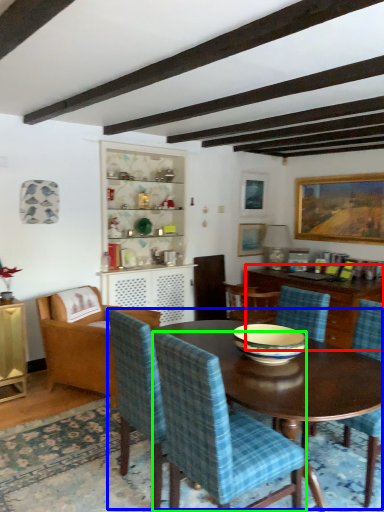
Question: Estimate the real-world distances between objects in this image. Which object is farther from cabinetry (highlighted by a red box), kitchen & dining room table (highlighted by a blue box) or chair (highlighted by a green box)?

Choices:
 (A) kitchen & dining room table
 (B) chair

Answer: (B)